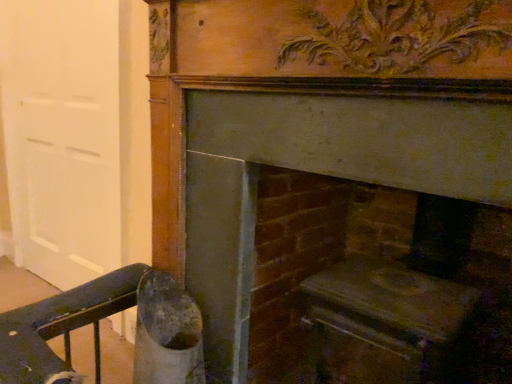
This screenshot has width=512, height=384. Describe the element at coordinates (337, 186) in the screenshot. I see `wooden fireplace at center, the second fireplace viewed from the right` at that location.

The height and width of the screenshot is (384, 512). What are the coordinates of `smooth stone hearth at center, positioned as the first fireplace in right-to-left order` in the screenshot? It's located at (377, 286).

How much space does smooth stone hearth at center, positioned as the first fireplace in right-to-left order, occupy horizontally?

It is 27.92 inches.

At what (x,y) coordinates should I click in order to perform the action: click on wooden fireplace at center, the second fireplace viewed from the right. Please return your answer as a coordinate pair (x, y). Looking at the image, I should click on (337, 186).

Which point is more distant from viewer, (x=285, y=314) or (x=19, y=37)?

Positioned behind is point (x=19, y=37).

The width and height of the screenshot is (512, 384). I want to click on the 1st fireplace in front of the white matte door at left, so click(x=377, y=286).

From the image's perspective, which object appears higher, smooth stone hearth at center, which is the 2th fireplace in left-to-right order, or white matte door at left?

white matte door at left.

Does smooth stone hearth at center, which is the 2th fireplace in left-to-right order, appear on the left side of white matte door at left?

Incorrect, smooth stone hearth at center, which is the 2th fireplace in left-to-right order, is not on the left side of white matte door at left.

In the scene shown: From the image's perspective, relative to smooth stone hearth at center, positioned as the first fireplace in right-to-left order, is wooden fireplace at center, marked as the 1th fireplace in a left-to-right arrangement, above or below?

wooden fireplace at center, marked as the 1th fireplace in a left-to-right arrangement, is situated higher than smooth stone hearth at center, positioned as the first fireplace in right-to-left order, in the image.

Who is bigger, wooden fireplace at center, marked as the 1th fireplace in a left-to-right arrangement, or smooth stone hearth at center, positioned as the first fireplace in right-to-left order?

smooth stone hearth at center, positioned as the first fireplace in right-to-left order, is bigger.

From a real-world perspective, is wooden fireplace at center, marked as the 1th fireplace in a left-to-right arrangement, positioned above or below smooth stone hearth at center, which is the 2th fireplace in left-to-right order?

From a real-world perspective, wooden fireplace at center, marked as the 1th fireplace in a left-to-right arrangement, is physically above smooth stone hearth at center, which is the 2th fireplace in left-to-right order.

Based on the photo, could you measure the distance between wooden fireplace at center, the second fireplace viewed from the right, and smooth stone hearth at center, which is the 2th fireplace in left-to-right order?

3.12 inches.

Can you confirm if white matte door at left is wider than smooth stone hearth at center, positioned as the first fireplace in right-to-left order?

No.

From the picture: Considering the relative sizes of white matte door at left and smooth stone hearth at center, positioned as the first fireplace in right-to-left order, in the image provided, is white matte door at left smaller than smooth stone hearth at center, positioned as the first fireplace in right-to-left order,?

Indeed, white matte door at left has a smaller size compared to smooth stone hearth at center, positioned as the first fireplace in right-to-left order.

Is white matte door at left positioned beyond the bounds of smooth stone hearth at center, which is the 2th fireplace in left-to-right order?

white matte door at left is positioned outside smooth stone hearth at center, which is the 2th fireplace in left-to-right order.

Looking at this image, from the image's perspective, which one is positioned lower, white matte door at left or wooden fireplace at center, the second fireplace viewed from the right?

wooden fireplace at center, the second fireplace viewed from the right, appears lower in the image.

Is white matte door at left to the left or to the right of wooden fireplace at center, marked as the 1th fireplace in a left-to-right arrangement, in the image?

In the image, white matte door at left appears on the left side of wooden fireplace at center, marked as the 1th fireplace in a left-to-right arrangement.

This screenshot has height=384, width=512. There is a white matte door at left. In order to click on the 1st fireplace below it (from the image's perspective) in this screenshot , I will do `click(337, 186)`.

Can we say white matte door at left lies outside wooden fireplace at center, the second fireplace viewed from the right?

Yes, white matte door at left is located beyond the bounds of wooden fireplace at center, the second fireplace viewed from the right.

Is smooth stone hearth at center, which is the 2th fireplace in left-to-right order, with wooden fireplace at center, marked as the 1th fireplace in a left-to-right arrangement?

Yes, smooth stone hearth at center, which is the 2th fireplace in left-to-right order, and wooden fireplace at center, marked as the 1th fireplace in a left-to-right arrangement, clearly make contact.

From the image's perspective, would you say smooth stone hearth at center, positioned as the first fireplace in right-to-left order, is positioned over wooden fireplace at center, the second fireplace viewed from the right?

Incorrect, from the image's perspective, smooth stone hearth at center, positioned as the first fireplace in right-to-left order, is lower than wooden fireplace at center, the second fireplace viewed from the right.

I want to click on fireplace lying below the wooden fireplace at center, marked as the 1th fireplace in a left-to-right arrangement (from the image's perspective), so click(377, 286).

Is smooth stone hearth at center, which is the 2th fireplace in left-to-right order, thinner than wooden fireplace at center, the second fireplace viewed from the right?

Incorrect, the width of smooth stone hearth at center, which is the 2th fireplace in left-to-right order, is not less than that of wooden fireplace at center, the second fireplace viewed from the right.

Considering the positions of points (172, 218) and (47, 77), is point (172, 218) closer to camera compared to point (47, 77)?

Yes, it is.

Which of these two, wooden fireplace at center, marked as the 1th fireplace in a left-to-right arrangement, or white matte door at left, is wider?

wooden fireplace at center, marked as the 1th fireplace in a left-to-right arrangement, is wider.

From the image's perspective, is wooden fireplace at center, marked as the 1th fireplace in a left-to-right arrangement, under white matte door at left?

Yes.

Is the position of wooden fireplace at center, marked as the 1th fireplace in a left-to-right arrangement, less distant than that of white matte door at left?

Yes, wooden fireplace at center, marked as the 1th fireplace in a left-to-right arrangement, is in front of white matte door at left.

Locate an element on the screen. the 2nd fireplace directly beneath the white matte door at left (from a real-world perspective) is located at coordinates (377, 286).

This screenshot has width=512, height=384. In order to click on fireplace on the right of wooden fireplace at center, marked as the 1th fireplace in a left-to-right arrangement in this screenshot , I will do `click(377, 286)`.

From the image, which object appears to be nearer to wooden fireplace at center, marked as the 1th fireplace in a left-to-right arrangement, smooth stone hearth at center, which is the 2th fireplace in left-to-right order, or white matte door at left?

smooth stone hearth at center, which is the 2th fireplace in left-to-right order, is positioned closer to the anchor wooden fireplace at center, marked as the 1th fireplace in a left-to-right arrangement.

Estimate the real-world distances between objects in this image. Which object is closer to white matte door at left, wooden fireplace at center, marked as the 1th fireplace in a left-to-right arrangement, or smooth stone hearth at center, which is the 2th fireplace in left-to-right order?

wooden fireplace at center, marked as the 1th fireplace in a left-to-right arrangement.

Based on their spatial positions, is wooden fireplace at center, marked as the 1th fireplace in a left-to-right arrangement, or white matte door at left further from smooth stone hearth at center, positioned as the first fireplace in right-to-left order?

white matte door at left is further to smooth stone hearth at center, positioned as the first fireplace in right-to-left order.

Consider the image. Which object lies nearer to the anchor point wooden fireplace at center, marked as the 1th fireplace in a left-to-right arrangement, white matte door at left or smooth stone hearth at center, which is the 2th fireplace in left-to-right order?

smooth stone hearth at center, which is the 2th fireplace in left-to-right order, lies closer to wooden fireplace at center, marked as the 1th fireplace in a left-to-right arrangement, than the other object.

Based on their spatial positions, is white matte door at left or wooden fireplace at center, the second fireplace viewed from the right, further from smooth stone hearth at center, positioned as the first fireplace in right-to-left order?

Based on the image, white matte door at left appears to be further to smooth stone hearth at center, positioned as the first fireplace in right-to-left order.

Based on their spatial positions, is smooth stone hearth at center, which is the 2th fireplace in left-to-right order, or wooden fireplace at center, the second fireplace viewed from the right, further from white matte door at left?

smooth stone hearth at center, which is the 2th fireplace in left-to-right order, is positioned further to the anchor white matte door at left.

I want to click on fireplace located between white matte door at left and smooth stone hearth at center, positioned as the first fireplace in right-to-left order, in the left-right direction, so click(x=337, y=186).